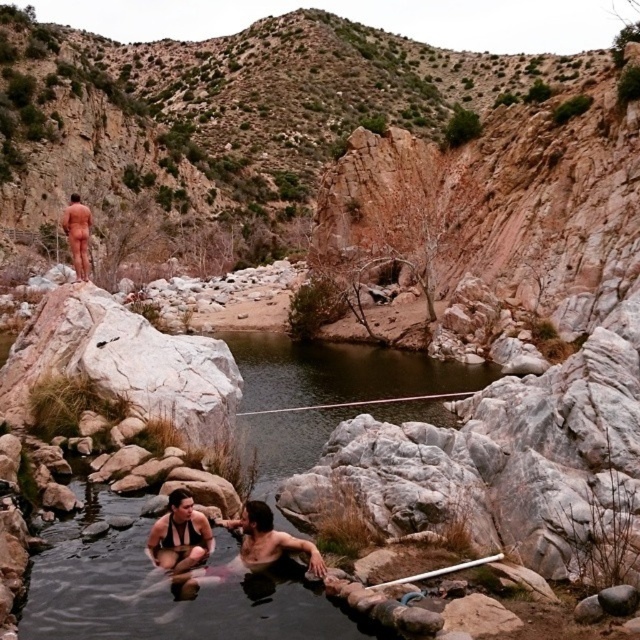
Who is shorter, matte black swimsuit at center or nude skin at upper left?

Standing shorter between the two is matte black swimsuit at center.

Is matte black swimsuit at center thinner than nude skin at upper left?

Indeed, matte black swimsuit at center has a lesser width compared to nude skin at upper left.

This screenshot has height=640, width=640. What do you see at coordinates (212, 544) in the screenshot?
I see `matte black swimsuit at center` at bounding box center [212, 544].

This screenshot has width=640, height=640. Identify the location of matte black swimsuit at center. (212, 544).